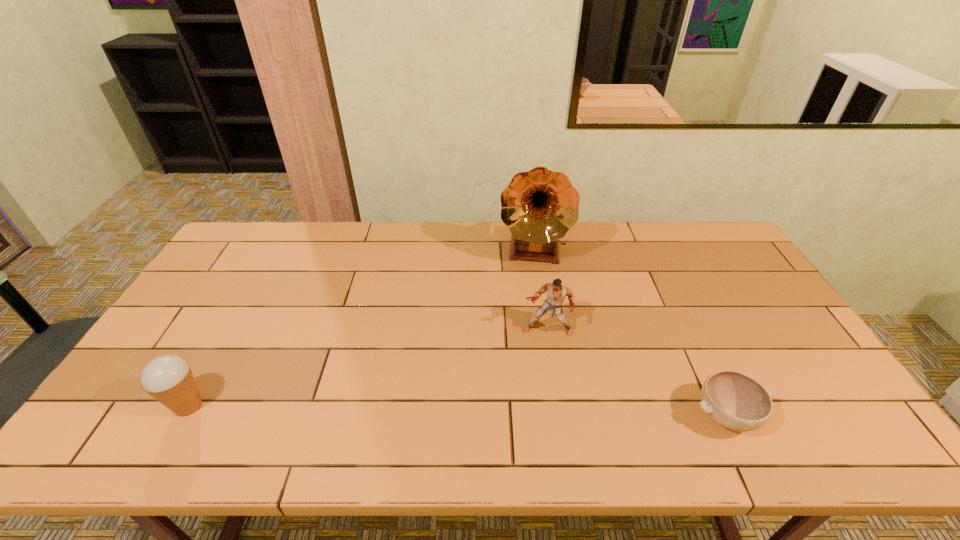
Locate an element on the screen. vacant space at the near edge of the desktop is located at coordinates (544, 406).

This screenshot has height=540, width=960. In order to click on free space at the left edge of the desktop in this screenshot , I will do `click(183, 334)`.

Locate an element on the screen. Image resolution: width=960 pixels, height=540 pixels. vacant area at the right edge is located at coordinates tap(794, 362).

You are a GUI agent. You are given a task and a screenshot of the screen. Output one action in this format:
    pyautogui.click(x=<x>, y=<y>)
    Task: Click on the free spot at the far left corner of the desktop
    The width and height of the screenshot is (960, 540).
    Given the screenshot: What is the action you would take?
    pyautogui.click(x=241, y=245)

In order to click on vacant area that lies between the shortest object and the phonograph_record in this screenshot , I will do `click(629, 333)`.

This screenshot has width=960, height=540. I want to click on empty location between the rightmost object and the icecream, so click(457, 411).

Locate an element on the screen. empty location between the rightmost object and the farthest object is located at coordinates (629, 333).

The image size is (960, 540). In order to click on free space that is in between the rightmost object and the second farthest object in this screenshot , I will do `click(636, 373)`.

Find the location of a particular element. empty location between the shortest object and the second farthest object is located at coordinates (636, 373).

Find the location of a particular element. The height and width of the screenshot is (540, 960). free space between the leftmost object and the farthest object is located at coordinates (360, 328).